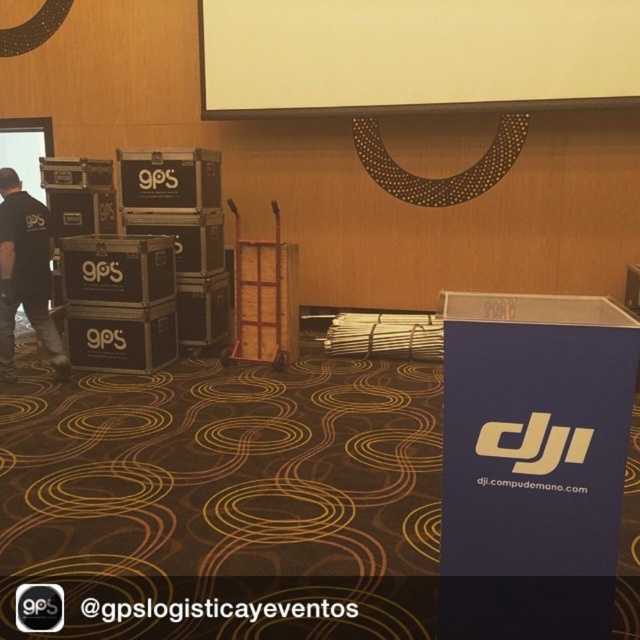
You are standing in the conference room and want to check both the white matte projection screen at upper center and the black fabric shirt at left. Which object is closer to you?

The white matte projection screen at upper center is closer to you because it is further to the viewer than the black fabric shirt at left.

You are a stagehand setting up for an event. You need to place a microphone stand that is 2 meters long between the white matte projection screen at upper center and the black fabric shirt at left. Is there enough space between them to fit the microphone stand horizontally?

The distance between the white matte projection screen at upper center and the black fabric shirt at left is 2.55 meters. Since the microphone stand is 2 meters long, there is sufficient space to place it horizontally between them.

You are setting up for a presentation and need to ensure the white matte projection screen at upper center is visible to everyone. Considering the black fabric shirt at left, which object is shorter and might block the view if positioned incorrectly?

The white matte projection screen at upper center is shorter than the black fabric shirt at left. Therefore, the screen might be blocked by the shirt if placed in front of it.